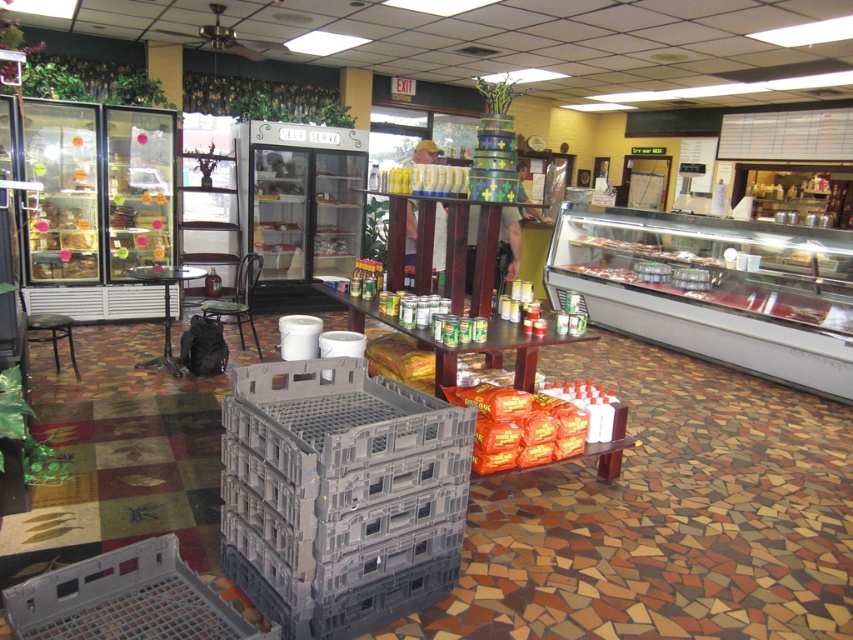
Between point (289, 525) and point (38, 321), which one is positioned in front?

Positioned in front is point (289, 525).

Is gray plastic crate at center smaller than black plastic stool at lower left?

→ No, gray plastic crate at center is not smaller than black plastic stool at lower left.

Which is behind, point (329, 420) or point (42, 323)?

Positioned behind is point (42, 323).

Identify the location of gray plastic crate at center. (340, 493).